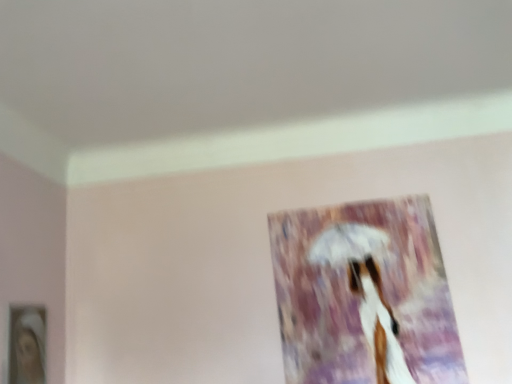
Question: Should I look upward or downward to see matte white picture frame at lower left, the 2th picture frame when ordered from back to front?

Choices:
 (A) down
 (B) up

Answer: (A)

Question: Is the position of matte glass picture frame at center, the second picture frame positioned from the left, more distant than that of matte white picture frame at lower left, which appears as the 1th picture frame when viewed from the left?

Choices:
 (A) no
 (B) yes

Answer: (B)

Question: Is matte glass picture frame at center, acting as the 1th picture frame starting from the back, aimed at matte white picture frame at lower left, which is the 1th picture frame from front to back?

Choices:
 (A) no
 (B) yes

Answer: (A)

Question: Is matte glass picture frame at center, which appears as the 2th picture frame when viewed from the front, to the right of matte white picture frame at lower left, which is counted as the 2th picture frame, starting from the right, from the viewer's perspective?

Choices:
 (A) yes
 (B) no

Answer: (A)

Question: Considering the relative sizes of matte glass picture frame at center, which appears as the 2th picture frame when viewed from the front, and matte white picture frame at lower left, which is counted as the 2th picture frame, starting from the right, in the image provided, is matte glass picture frame at center, which appears as the 2th picture frame when viewed from the front, thinner than matte white picture frame at lower left, which is counted as the 2th picture frame, starting from the right,?

Choices:
 (A) no
 (B) yes

Answer: (B)

Question: Does matte glass picture frame at center, positioned as the first picture frame in right-to-left order, have a lesser height compared to matte white picture frame at lower left, the 2th picture frame when ordered from back to front?

Choices:
 (A) yes
 (B) no

Answer: (B)

Question: From the image's perspective, is matte glass picture frame at center, positioned as the first picture frame in right-to-left order, below matte white picture frame at lower left, the 2th picture frame when ordered from back to front?

Choices:
 (A) yes
 (B) no

Answer: (B)

Question: Is matte white picture frame at lower left, which is the 1th picture frame from front to back, facing away from matte glass picture frame at center, which appears as the 2th picture frame when viewed from the front?

Choices:
 (A) no
 (B) yes

Answer: (A)

Question: From a real-world perspective, is matte white picture frame at lower left, which appears as the 1th picture frame when viewed from the left, beneath matte glass picture frame at center, acting as the 1th picture frame starting from the back?

Choices:
 (A) no
 (B) yes

Answer: (B)

Question: Can you confirm if matte white picture frame at lower left, the 2th picture frame when ordered from back to front, is smaller than matte glass picture frame at center, positioned as the first picture frame in right-to-left order?

Choices:
 (A) yes
 (B) no

Answer: (A)

Question: Is the position of matte white picture frame at lower left, which appears as the 1th picture frame when viewed from the left, more distant than that of matte glass picture frame at center, positioned as the first picture frame in right-to-left order?

Choices:
 (A) no
 (B) yes

Answer: (A)

Question: Does matte white picture frame at lower left, which appears as the 1th picture frame when viewed from the left, have a greater height compared to matte glass picture frame at center, the second picture frame positioned from the left?

Choices:
 (A) yes
 (B) no

Answer: (B)

Question: Can you confirm if matte white picture frame at lower left, the 2th picture frame when ordered from back to front, is positioned to the left of matte glass picture frame at center, acting as the 1th picture frame starting from the back?

Choices:
 (A) no
 (B) yes

Answer: (B)

Question: In terms of size, does matte white picture frame at lower left, which is the 1th picture frame from front to back, appear bigger or smaller than matte glass picture frame at center, positioned as the first picture frame in right-to-left order?

Choices:
 (A) big
 (B) small

Answer: (B)